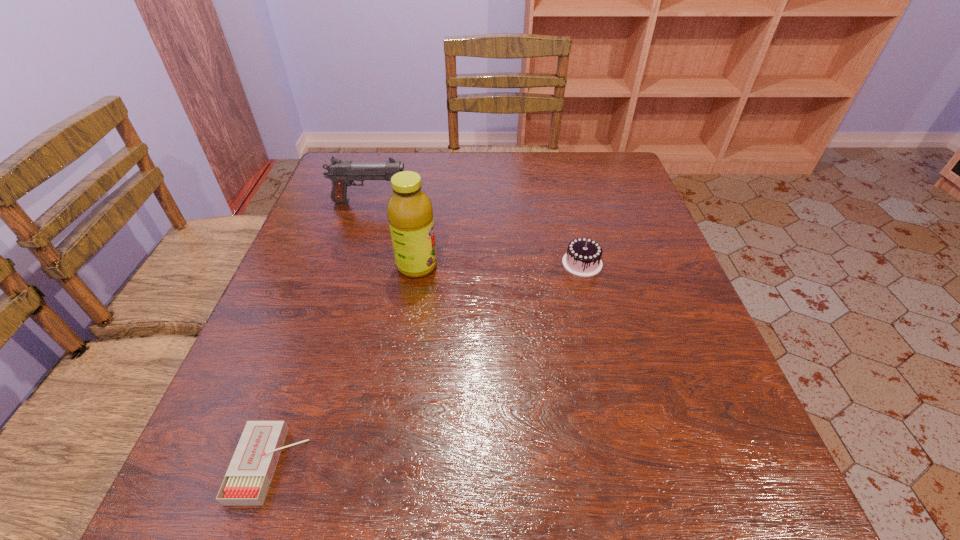
This screenshot has height=540, width=960. In order to click on vacant space at the right edge in this screenshot , I will do `click(684, 349)`.

Find the location of a particular element. Image resolution: width=960 pixels, height=540 pixels. vacant region at the near left corner of the desktop is located at coordinates (238, 518).

This screenshot has height=540, width=960. In the image, there is a desktop. What are the coordinates of `vacant space at the far right corner` in the screenshot? It's located at (603, 195).

Identify the location of free space between the rightmost object and the nearest object. This screenshot has width=960, height=540. (426, 364).

Where is `unoccupied position between the nearest object and the tallest object`? Image resolution: width=960 pixels, height=540 pixels. unoccupied position between the nearest object and the tallest object is located at coordinates (344, 366).

The height and width of the screenshot is (540, 960). I want to click on empty space that is in between the chocolate cake and the nearest object, so click(426, 364).

The image size is (960, 540). I want to click on free space between the rightmost object and the third shortest object, so [476, 232].

This screenshot has width=960, height=540. I want to click on free space between the farthest object and the third tallest object, so click(x=476, y=232).

This screenshot has height=540, width=960. I want to click on free space between the chocolate cake and the farthest object, so click(x=476, y=232).

This screenshot has height=540, width=960. Find the location of `vacant region between the tallest object and the third tallest object`. vacant region between the tallest object and the third tallest object is located at coordinates (499, 265).